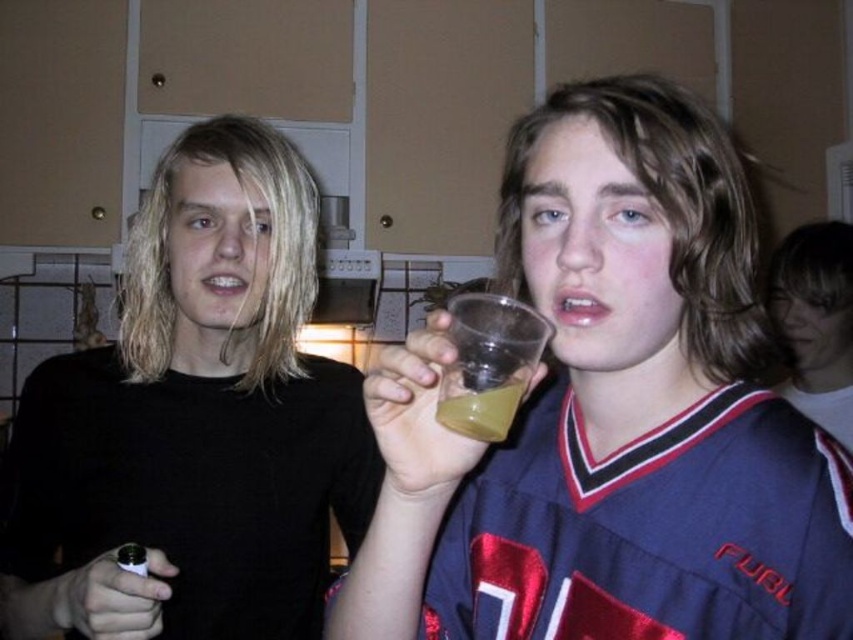
Question: Considering the real-world distances, which object is farthest from the transparent plastic cup at center?

Choices:
 (A) translucent plastic cup at center
 (B) blue jersey at center

Answer: (B)

Question: Is transparent plastic cup at center bigger than black matte shirt at left?

Choices:
 (A) yes
 (B) no

Answer: (B)

Question: Is transparent plastic cup at center positioned at the back of black matte shirt at left?

Choices:
 (A) no
 (B) yes

Answer: (A)

Question: Can you confirm if black matte shirt at left is thinner than translucent plastic cup at center?

Choices:
 (A) no
 (B) yes

Answer: (A)

Question: Which is nearer to the transparent plastic cup at center?

Choices:
 (A) black matte shirt at left
 (B) blue jersey at center
 (C) translucent plastic cup at center

Answer: (C)

Question: Which of the following is the farthest from the observer?

Choices:
 (A) (521, 392)
 (B) (78, 540)

Answer: (B)